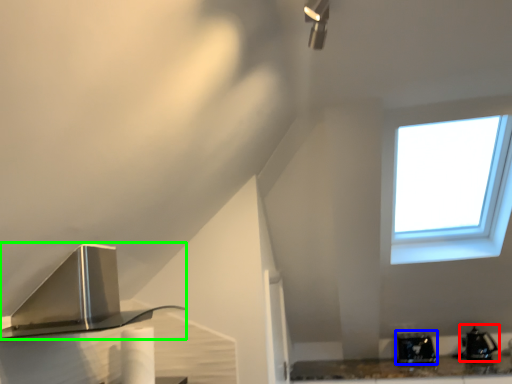
Question: Estimate the real-world distances between objects in this image. Which object is farther from appliance (highlighted by a red box), appliance (highlighted by a blue box) or kitchen appliance (highlighted by a green box)?

Choices:
 (A) appliance
 (B) kitchen appliance

Answer: (B)